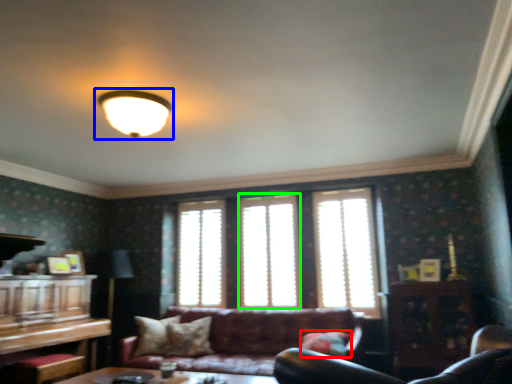
Question: Estimate the real-world distances between objects in this image. Which object is closer to pillow (highlighted by a red box), lamp (highlighted by a blue box) or window (highlighted by a green box)?

Choices:
 (A) lamp
 (B) window

Answer: (B)